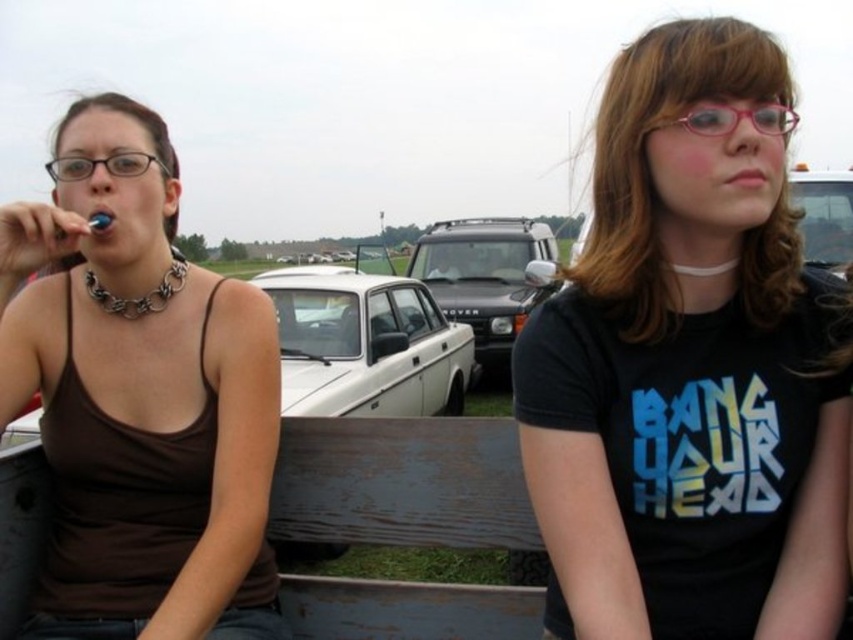
Does silver chain necklace at upper center have a lesser height compared to white plastic toothbrush at left?

Yes, silver chain necklace at upper center is shorter than white plastic toothbrush at left.

Between point (698, 273) and point (93, 221), which one is positioned in front?

Point (698, 273) is in front.

At what (x,y) coordinates should I click in order to perform the action: click on silver chain necklace at upper center. Please return your answer as a coordinate pair (x, y). Looking at the image, I should click on (704, 268).

Does matte black suv at center have a smaller size compared to metallic silver car at center?

No.

How much distance is there between matte black suv at center and metallic silver car at center?

A distance of 17.28 feet exists between matte black suv at center and metallic silver car at center.

Measure the distance between matte black suv at center and camera.

They are 8.59 meters apart.

Identify the location of matte black suv at center. (485, 276).

In the scene shown: Is silver metallic chain at left closer to camera compared to white plastic toothbrush at left?

No, silver metallic chain at left is behind white plastic toothbrush at left.

Between silver metallic chain at left and white plastic toothbrush at left, which one has less height?

white plastic toothbrush at left is shorter.

Describe the element at coordinates (138, 296) in the screenshot. The height and width of the screenshot is (640, 853). I see `silver metallic chain at left` at that location.

I want to click on silver metallic chain at left, so (138, 296).